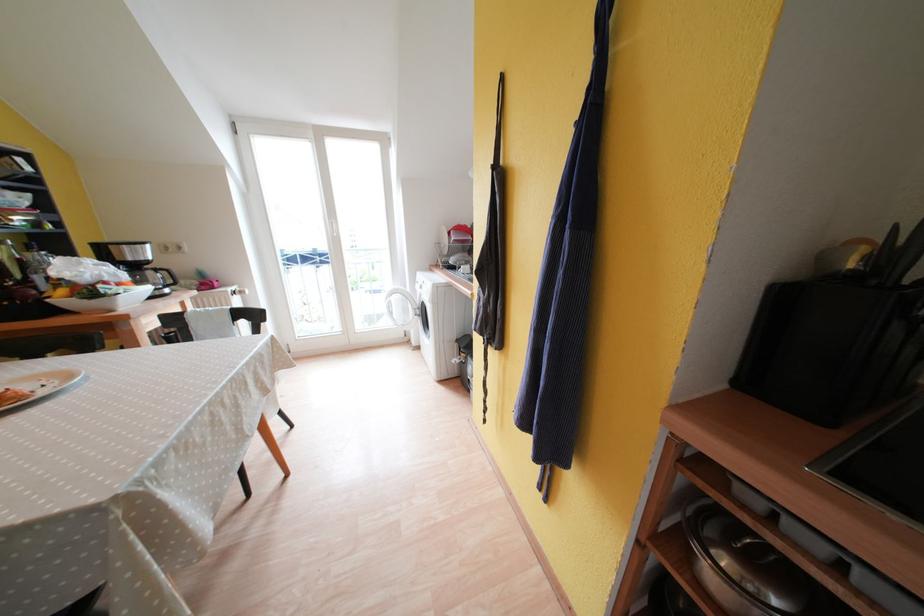
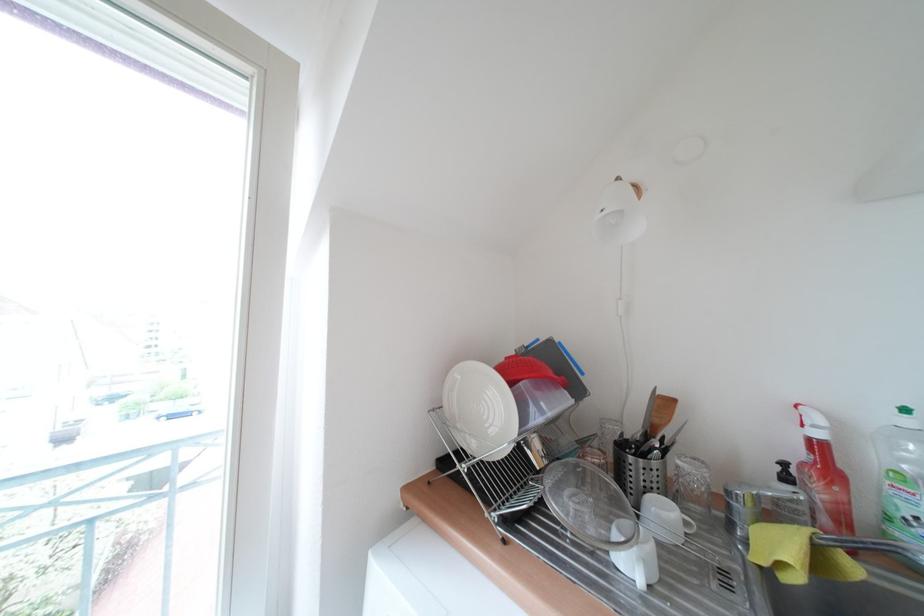
In the second image, find the point that corresponds to the point at 445,246 in the first image.

(444, 413)